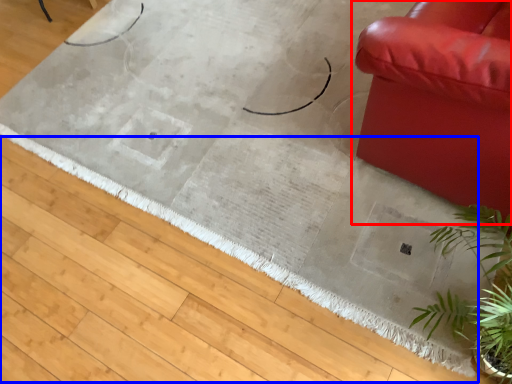
Question: Which of the following is the farthest to the observer, studio couch (highlighted by a red box) or doormat (highlighted by a blue box)?

Choices:
 (A) studio couch
 (B) doormat

Answer: (B)